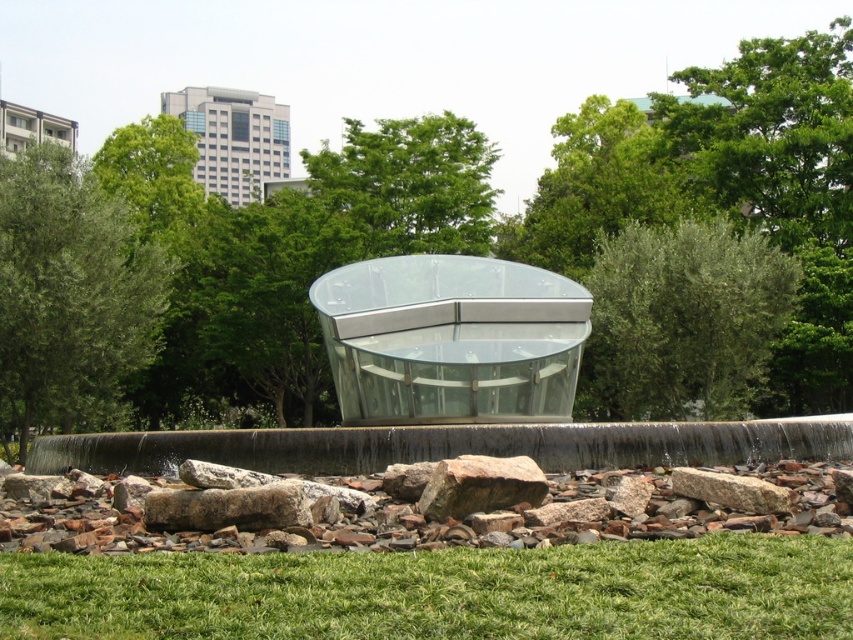
You are a visitor standing in front of the glass structure and want to sit on the transparent glass bench at center. Is the brown rough rock at lower center blocking your path to the bench?

The transparent glass bench at center is further to the viewer than brown rough rock at lower center, so the brown rough rock at lower center is behind the bench and not blocking the path.

You are a visitor standing in front of the glass structure and want to sit down. There is a transparent glass bench at center and a green leafy tree at upper center. Which object is shorter and can you sit on it?

The transparent glass bench at center is shorter than the green leafy tree at upper center. You can sit on the transparent glass bench at center since it is a bench designed for sitting, while the tree is a plant and not meant for sitting.

From the picture: You are standing in front of the glass dome structure and want to walk from point A to point B. Point A is located at coordinates point (366, 324) and point B is at point (436, 493). Which point will you encounter first as you approach the structure?

Point (366, 324) will be encountered first because it is closer to the viewer than point (436, 493), which is further away.